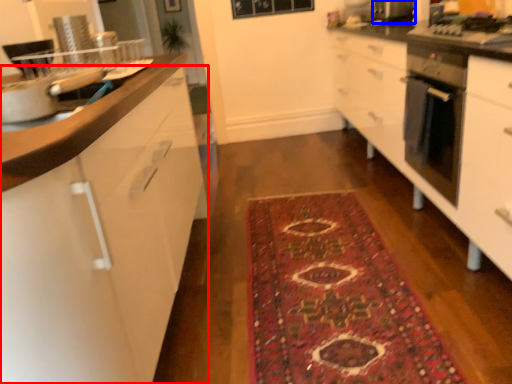
Question: Which point is closer to the camera, cabinetry (highlighted by a red box) or appliance (highlighted by a blue box)?

Choices:
 (A) cabinetry
 (B) appliance

Answer: (A)